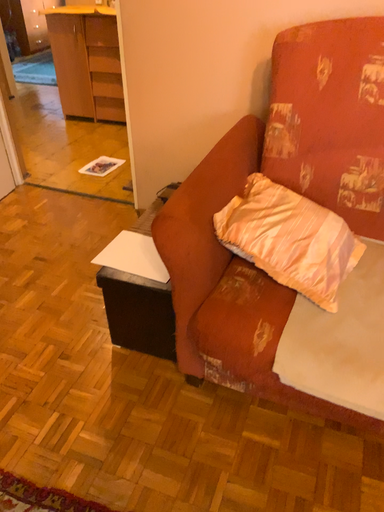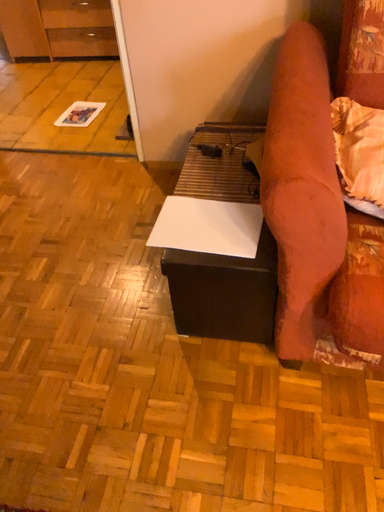
Question: How did the camera likely rotate when shooting the video?

Choices:
 (A) rotated upward
 (B) rotated downward

Answer: (B)